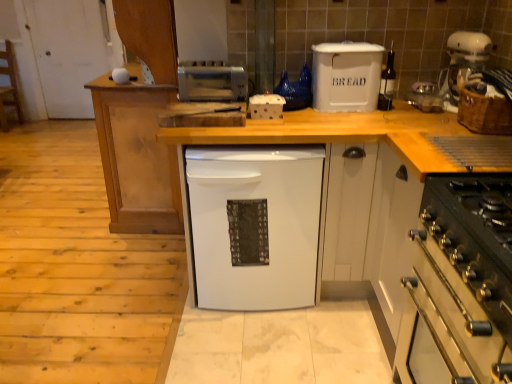
What are the coordinates of `free space in front of white plastic bread bin at upper center` in the screenshot? It's located at (348, 121).